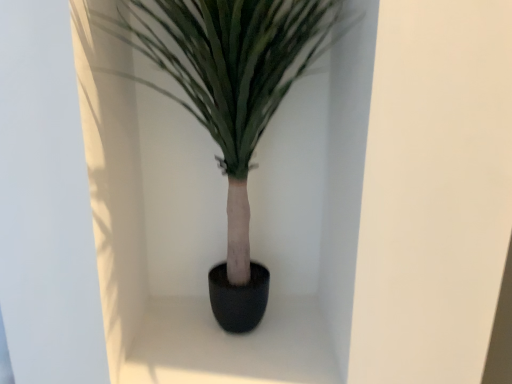
Locate an element on the screen. black matte pot at center is located at coordinates (230, 345).

Describe the element at coordinates (230, 345) in the screenshot. I see `black matte pot at center` at that location.

Describe the element at coordinates (233, 103) in the screenshot. I see `green matte plant at center` at that location.

You are a GUI agent. You are given a task and a screenshot of the screen. Output one action in this format:
    pyautogui.click(x=<x>, y=<y>)
    Task: Click on the green matte plant at center
    The height and width of the screenshot is (384, 512).
    Given the screenshot: What is the action you would take?
    pyautogui.click(x=233, y=103)

I want to click on black matte pot at center, so click(230, 345).

Is green matte plant at center to the left of black matte pot at center from the viewer's perspective?

Indeed, green matte plant at center is positioned on the left side of black matte pot at center.

Is the depth of green matte plant at center greater than that of black matte pot at center?

No, green matte plant at center is closer to the camera.

Which is closer to the camera, (223, 13) or (163, 364)?

Point (223, 13).

From the image's perspective, would you say green matte plant at center is positioned over black matte pot at center?

Yes, from the image's perspective, green matte plant at center is over black matte pot at center.

From a real-world perspective, is green matte plant at center over black matte pot at center?

Yes, from a real-world perspective, green matte plant at center is above black matte pot at center.

Considering the sizes of green matte plant at center and black matte pot at center in the image, is green matte plant at center wider or thinner than black matte pot at center?

Clearly, green matte plant at center has less width compared to black matte pot at center.

Which of these two, green matte plant at center or black matte pot at center, stands shorter?

black matte pot at center.

Is green matte plant at center bigger or smaller than black matte pot at center?

In the image, green matte plant at center appears to be larger than black matte pot at center.

Would you say green matte plant at center is outside black matte pot at center?

green matte plant at center is positioned outside black matte pot at center.

Is green matte plant at center next to black matte pot at center and touching it?

green matte plant at center and black matte pot at center are clearly separated.

Is green matte plant at center facing towards black matte pot at center?

No, green matte plant at center does not turn towards black matte pot at center.

How many degrees apart are the facing directions of green matte plant at center and black matte pot at center?

The angle between the facing direction of green matte plant at center and the facing direction of black matte pot at center is 0.000349 degrees.

Image resolution: width=512 pixels, height=384 pixels. I want to click on window sill below the green matte plant at center (from the image's perspective), so click(x=230, y=345).

Is black matte pot at center to the right of green matte plant at center from the viewer's perspective?

Correct, you'll find black matte pot at center to the right of green matte plant at center.

Which object is closer to the camera, black matte pot at center or green matte plant at center?

green matte plant at center is more forward.

Which is closer to the camera, (136, 347) or (279, 103)?

Point (136, 347) appears to be closer to the viewer than point (279, 103).

From the image's perspective, is black matte pot at center below green matte plant at center?

Yes, from the image's perspective, black matte pot at center is beneath green matte plant at center.

From a real-world perspective, is black matte pot at center located higher than green matte plant at center?

Actually, black matte pot at center is physically below green matte plant at center in the real world.

Considering the relative sizes of black matte pot at center and green matte plant at center in the image provided, is black matte pot at center thinner than green matte plant at center?

Incorrect, the width of black matte pot at center is not less than that of green matte plant at center.

Is black matte pot at center taller or shorter than green matte plant at center?

Considering their sizes, black matte pot at center has less height than green matte plant at center.

Between black matte pot at center and green matte plant at center, which one has larger size?

green matte plant at center is bigger.

Can green matte plant at center be found inside black matte pot at center?

No, green matte plant at center is not inside black matte pot at center.

Is black matte pot at center far away from green matte plant at center?

They are positioned close to each other.

Is black matte pot at center facing away from green matte plant at center?

black matte pot at center does not have its back to green matte plant at center.

What's the angular difference between black matte pot at center and green matte plant at center's facing directions?

The angle between the facing direction of black matte pot at center and the facing direction of green matte plant at center is 0.000349 degrees.

Find the location of a particular element. The width and height of the screenshot is (512, 384). houseplant that appears above the black matte pot at center (from the image's perspective) is located at coordinates (233, 103).

Locate an element on the screen. window sill beneath the green matte plant at center (from a real-world perspective) is located at coordinates (230, 345).

Find the location of a particular element. This screenshot has height=384, width=512. window sill behind the green matte plant at center is located at coordinates (230, 345).